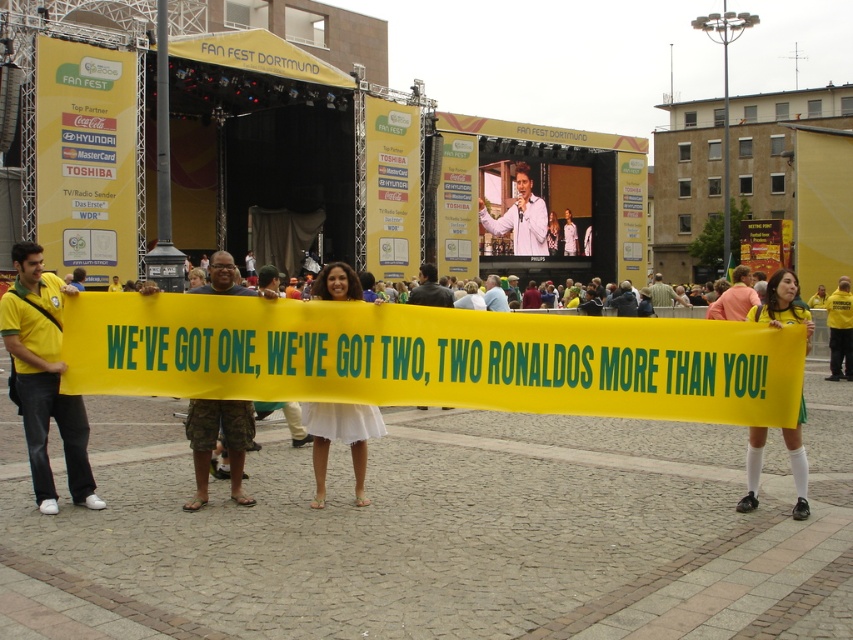
Question: Can you confirm if white fabric dress at center is smaller than light pink fabric at center?

Choices:
 (A) yes
 (B) no

Answer: (A)

Question: Does yellow fabric banner at center have a lesser width compared to white fabric dress at center?

Choices:
 (A) no
 (B) yes

Answer: (A)

Question: Which object is closer to the camera taking this photo?

Choices:
 (A) white shirt at center
 (B) white socks at lower right
 (C) camouflage shorts at center
 (D) yellow fabric banner at center

Answer: (D)

Question: Among these points, which one is nearest to the camera?

Choices:
 (A) (796, 500)
 (B) (228, 284)

Answer: (A)

Question: Can you confirm if yellow fabric banner at center is thinner than camouflage shorts at center?

Choices:
 (A) yes
 (B) no

Answer: (B)

Question: Which of the following is the closest to the observer?

Choices:
 (A) light pink fabric at center
 (B) white socks at lower right

Answer: (B)